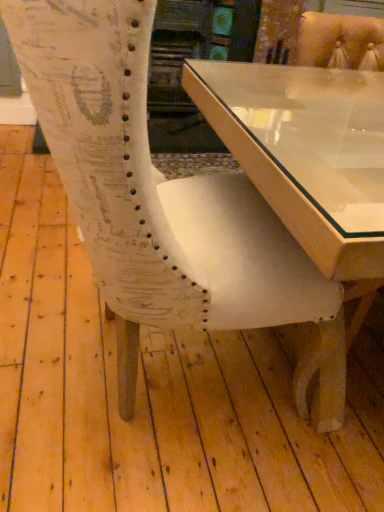
Locate an element on the screen. This screenshot has height=512, width=384. clear glass table at center is located at coordinates coord(308,158).

In order to face clear glass table at center, should I rotate leftwards or rightwards?

To face it directly, rotate right by 23.508 degrees.

Image resolution: width=384 pixels, height=512 pixels. What do you see at coordinates (308, 158) in the screenshot? I see `clear glass table at center` at bounding box center [308, 158].

This screenshot has height=512, width=384. Identify the location of clear glass table at center. [308, 158].